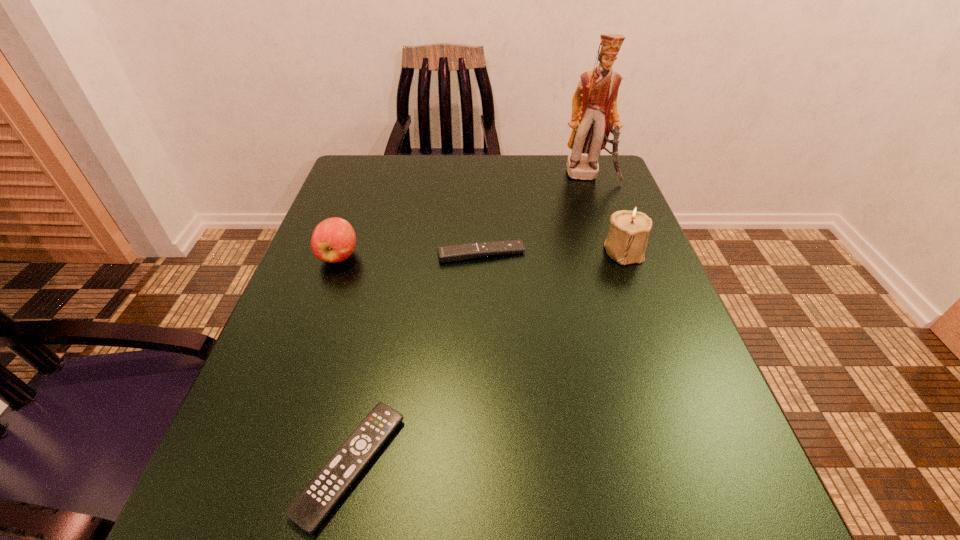
Image resolution: width=960 pixels, height=540 pixels. Find the location of `free region located 0.050m on the left of the candle_holder`. free region located 0.050m on the left of the candle_holder is located at coordinates (579, 251).

At what (x,y) coordinates should I click in order to perform the action: click on vacant area situated on the back of the apple. Please return your answer as a coordinate pair (x, y). Image resolution: width=960 pixels, height=540 pixels. Looking at the image, I should click on (375, 156).

Locate an element on the screen. vacant position located 0.150m on the back of the farther remote control is located at coordinates (481, 204).

Locate an element on the screen. This screenshot has height=540, width=960. vacant area situated 0.390m on the right of the nearer remote control is located at coordinates (686, 465).

Where is `object at the far edge`? Image resolution: width=960 pixels, height=540 pixels. object at the far edge is located at coordinates (594, 104).

At what (x,y) coordinates should I click in order to perform the action: click on object that is at the near edge. Please return your answer as a coordinate pair (x, y). Looking at the image, I should click on (309, 509).

You are a GUI agent. You are given a task and a screenshot of the screen. Output one action in this format:
    pyautogui.click(x=<x>, y=<y>)
    Task: Click on the apple that is at the left edge
    Image resolution: width=960 pixels, height=540 pixels.
    Given the screenshot: What is the action you would take?
    pyautogui.click(x=333, y=240)

Where is `remote control present at the left edge`? This screenshot has height=540, width=960. remote control present at the left edge is located at coordinates (309, 509).

Where is `nutcracker located in the right edge section of the desktop`? The width and height of the screenshot is (960, 540). nutcracker located in the right edge section of the desktop is located at coordinates (594, 104).

The height and width of the screenshot is (540, 960). Identify the location of candle_holder at the right edge. (628, 235).